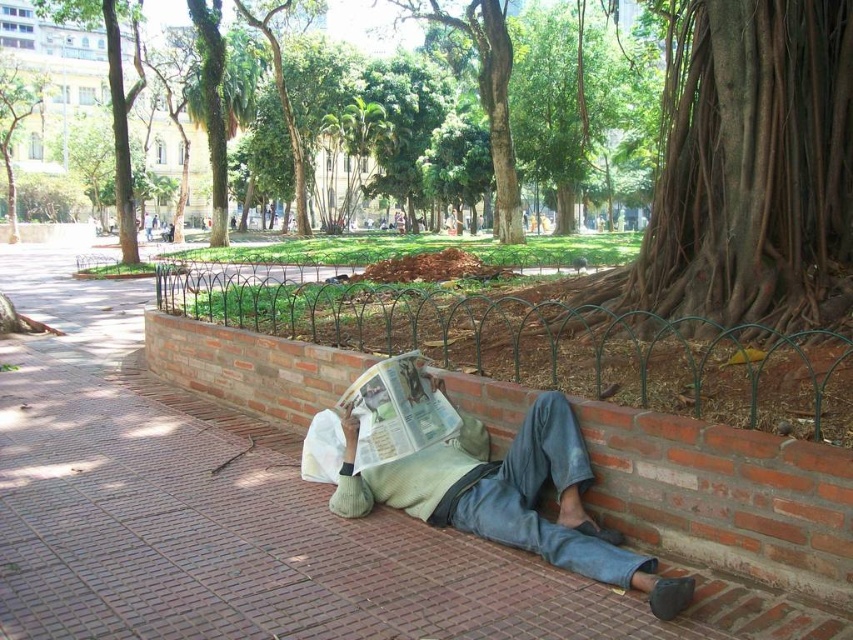
Question: Does brown rough bark at upper right appear on the right side of green leafy tree at upper center?

Choices:
 (A) yes
 (B) no

Answer: (A)

Question: Which of the following is the closest to the observer?

Choices:
 (A) (477, 192)
 (B) (402, 504)

Answer: (B)

Question: Is green leafy tree at upper center positioned behind light green sweater at lower center?

Choices:
 (A) no
 (B) yes

Answer: (B)

Question: Which point is closer to the camera taking this photo?

Choices:
 (A) (553, 460)
 (B) (564, 26)
 (C) (747, 145)

Answer: (A)

Question: Which object appears closest to the camera in this image?

Choices:
 (A) light green sweater at lower center
 (B) brown rough bark at upper right
 (C) green leafy tree at upper center

Answer: (A)

Question: Does green leafy tree at upper center appear on the right side of light green sweater at lower center?

Choices:
 (A) yes
 (B) no

Answer: (B)